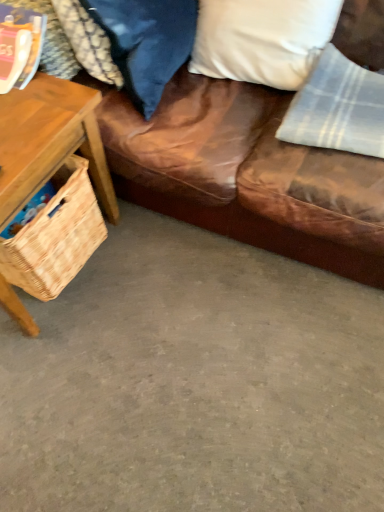
Find the location of a particular element. The height and width of the screenshot is (512, 384). free space above gray concrete floor at lower center (from a real-world perspective) is located at coordinates click(x=179, y=352).